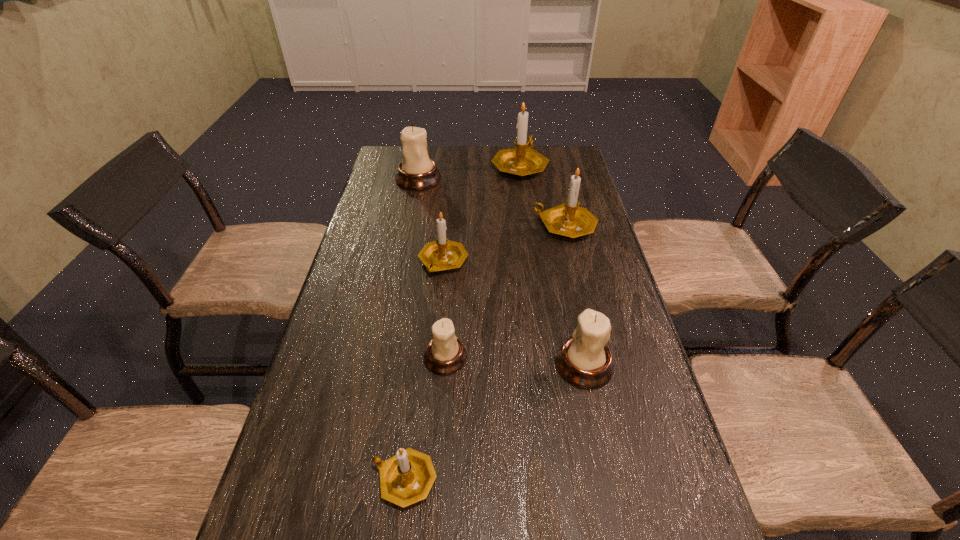
Where is `free space at the far edge of the desktop`? The width and height of the screenshot is (960, 540). free space at the far edge of the desktop is located at coordinates (481, 157).

At what (x,y) coordinates should I click in order to perform the action: click on vacant space at the left edge of the desktop. Please return your answer as a coordinate pair (x, y). Looking at the image, I should click on (367, 305).

In the image, there is a desktop. At what (x,y) coordinates should I click in order to perform the action: click on vacant space at the right edge. Please return your answer as a coordinate pair (x, y). This screenshot has width=960, height=540. Looking at the image, I should click on (626, 451).

At what (x,y) coordinates should I click in order to perform the action: click on free space between the third smallest gold candle holder and the second smallest gold candle holder. Please return your answer as a coordinate pair (x, y). Image resolution: width=960 pixels, height=540 pixels. Looking at the image, I should click on (504, 244).

Locate an element on the screen. free space between the tallest object and the second smallest gold candle holder is located at coordinates (482, 214).

Find the location of `vacant space that is in between the second biggest white candle holder and the second biggest gold candle holder`. vacant space that is in between the second biggest white candle holder and the second biggest gold candle holder is located at coordinates (575, 295).

Image resolution: width=960 pixels, height=540 pixels. In order to click on free space between the nearest gold candle holder and the third biggest gold candle holder in this screenshot , I will do `click(424, 370)`.

I want to click on free spot between the second smallest white candle holder and the third smallest gold candle holder, so click(x=575, y=295).

You are a GUI agent. You are given a task and a screenshot of the screen. Output one action in this format:
    pyautogui.click(x=<x>, y=<y>)
    Task: Click on the free space between the leftmost white candle holder and the tallest object
    
    Given the screenshot: What is the action you would take?
    pyautogui.click(x=469, y=173)

Locate an element on the screen. The image size is (960, 540). the closest object to the biggest gold candle holder is located at coordinates (567, 219).